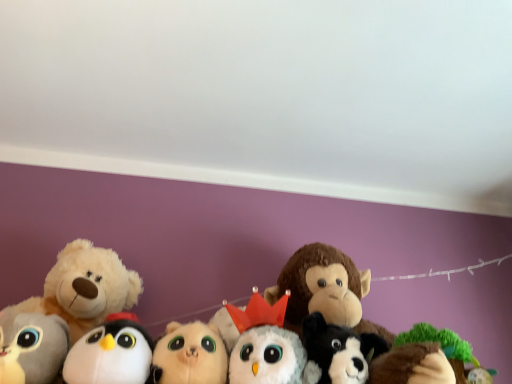
Where is `white plush penguin at lower left, the 5th toy positioned from the right`? This screenshot has height=384, width=512. white plush penguin at lower left, the 5th toy positioned from the right is located at coordinates [111, 353].

You are a GUI agent. You are given a task and a screenshot of the screen. Output one action in this format:
    pyautogui.click(x=<x>, y=<y>)
    Task: Click on the gray plush toy at lower left, the seventh toy in the right-to-left sequence
    
    Given the screenshot: What is the action you would take?
    pyautogui.click(x=31, y=346)

What do you see at coordinates (31, 346) in the screenshot?
I see `gray plush toy at lower left, the seventh toy in the right-to-left sequence` at bounding box center [31, 346].

Where is `white plush owl at center, the 5th toy when ordered from left to right`? The image size is (512, 384). white plush owl at center, the 5th toy when ordered from left to right is located at coordinates (267, 346).

I want to click on white plush dog at center, the 6th toy from the left, so click(340, 350).

Image resolution: width=512 pixels, height=384 pixels. Find the location of `white plush penguin at lower left, the 5th toy positioned from the right`. white plush penguin at lower left, the 5th toy positioned from the right is located at coordinates (111, 353).

Is point (104, 341) closer or farther from the camera than point (46, 315)?

Clearly, point (104, 341) is closer to the camera than point (46, 315).

Is white plush penguin at lower left, placed as the 3th toy when sorted from left to right, wider than gray plush toy at lower left, the first toy when ordered from left to right?

No, white plush penguin at lower left, placed as the 3th toy when sorted from left to right, is not wider than gray plush toy at lower left, the first toy when ordered from left to right.

From the image's perspective, between white plush penguin at lower left, placed as the 3th toy when sorted from left to right, and gray plush toy at lower left, the seventh toy in the right-to-left sequence, which one is located above?

white plush penguin at lower left, placed as the 3th toy when sorted from left to right.

Is white plush penguin at lower left, placed as the 3th toy when sorted from left to right, looking in the opposite direction of gray plush toy at lower left, the seventh toy in the right-to-left sequence?

No, white plush penguin at lower left, placed as the 3th toy when sorted from left to right, is not facing away from gray plush toy at lower left, the seventh toy in the right-to-left sequence.

Is green plush tree at lower right, arranged as the seventh toy when viewed from the left, far away from white plush owl at center, which is the third toy in right-to-left order?

No, green plush tree at lower right, arranged as the seventh toy when viewed from the left, is not far away from white plush owl at center, which is the third toy in right-to-left order.

Considering the sizes of green plush tree at lower right, arranged as the seventh toy when viewed from the left, and white plush owl at center, which is the third toy in right-to-left order, in the image, is green plush tree at lower right, arranged as the seventh toy when viewed from the left, bigger or smaller than white plush owl at center, which is the third toy in right-to-left order,?

In the image, green plush tree at lower right, arranged as the seventh toy when viewed from the left, appears to be smaller than white plush owl at center, which is the third toy in right-to-left order.

From the white plush owl at center, the 5th toy when ordered from left to right, count 2nd toy to the right and point to it. Please provide its 2D coordinates.

[(449, 351)]

From the picture: From a real-world perspective, which is physically above, green plush tree at lower right, acting as the 1th toy starting from the right, or white plush owl at center, which is the third toy in right-to-left order?

white plush owl at center, which is the third toy in right-to-left order, is physically above.

Would you say green plush tree at lower right, arranged as the seventh toy when viewed from the left, is inside or outside white plush penguin at lower left, the 5th toy positioned from the right?

green plush tree at lower right, arranged as the seventh toy when viewed from the left, is spatially situated outside white plush penguin at lower left, the 5th toy positioned from the right.

Is green plush tree at lower right, acting as the 1th toy starting from the right, touching white plush penguin at lower left, the 5th toy positioned from the right?

green plush tree at lower right, acting as the 1th toy starting from the right, and white plush penguin at lower left, the 5th toy positioned from the right, are not in contact.

Is point (408, 336) closer to viewer compared to point (124, 351)?

No, it is not.

Considering the positions of objects white plush dog at center, the 6th toy from the left, and white plush penguin at lower left, placed as the 3th toy when sorted from left to right, in the image provided, who is more to the left, white plush dog at center, the 6th toy from the left, or white plush penguin at lower left, placed as the 3th toy when sorted from left to right,?

From the viewer's perspective, white plush penguin at lower left, placed as the 3th toy when sorted from left to right, appears more on the left side.

This screenshot has width=512, height=384. Identify the location of toy that is the 4th one when counting downward from the white plush penguin at lower left, the 5th toy positioned from the right (from the image's perspective). (340, 350).

Is white plush dog at center, which is the second toy from right to left, oriented away from white plush penguin at lower left, the 5th toy positioned from the right?

No, white plush dog at center, which is the second toy from right to left, is not facing away from white plush penguin at lower left, the 5th toy positioned from the right.

Between white plush dog at center, which is the second toy from right to left, and white plush penguin at lower left, placed as the 3th toy when sorted from left to right, which one has more height?

white plush penguin at lower left, placed as the 3th toy when sorted from left to right, is taller.

Considering the relative sizes of white plush owl at center, the 5th toy when ordered from left to right, and fluffy beige cat at center, acting as the 4th toy starting from the right, in the image provided, is white plush owl at center, the 5th toy when ordered from left to right, bigger than fluffy beige cat at center, acting as the 4th toy starting from the right,?

Yes.

Can you see white plush owl at center, which is the third toy in right-to-left order, touching fluffy beige cat at center, which is counted as the 4th toy, starting from the left?

Yes, white plush owl at center, which is the third toy in right-to-left order, is beside fluffy beige cat at center, which is counted as the 4th toy, starting from the left.

Is the position of white plush owl at center, which is the third toy in right-to-left order, more distant than that of fluffy beige cat at center, which is counted as the 4th toy, starting from the left?

Yes, white plush owl at center, which is the third toy in right-to-left order, is further from the camera.

Would you say green plush tree at lower right, arranged as the seventh toy when viewed from the left, is a long distance from fluffy white teddy bear at left, arranged as the sixth toy when viewed from the right?

No, green plush tree at lower right, arranged as the seventh toy when viewed from the left, is in close proximity to fluffy white teddy bear at left, arranged as the sixth toy when viewed from the right.

Is green plush tree at lower right, acting as the 1th toy starting from the right, wider or thinner than fluffy white teddy bear at left, the second toy from the left?

Considering their sizes, green plush tree at lower right, acting as the 1th toy starting from the right, looks slimmer than fluffy white teddy bear at left, the second toy from the left.

Is green plush tree at lower right, acting as the 1th toy starting from the right, bigger than fluffy white teddy bear at left, arranged as the sixth toy when viewed from the right?

No.

Can you tell me how much green plush tree at lower right, arranged as the seventh toy when viewed from the left, and fluffy white teddy bear at left, the second toy from the left, differ in facing direction?

The facing directions of green plush tree at lower right, arranged as the seventh toy when viewed from the left, and fluffy white teddy bear at left, the second toy from the left, are 4.24 degrees apart.

How distant is white plush penguin at lower left, the 5th toy positioned from the right, from white plush owl at center, the 5th toy when ordered from left to right?

white plush penguin at lower left, the 5th toy positioned from the right, is 8.70 inches from white plush owl at center, the 5th toy when ordered from left to right.

I want to click on the 2nd toy located above the white plush penguin at lower left, the 5th toy positioned from the right (from a real-world perspective), so click(x=267, y=346).

Which of these two, white plush penguin at lower left, the 5th toy positioned from the right, or white plush owl at center, the 5th toy when ordered from left to right, is wider?

white plush owl at center, the 5th toy when ordered from left to right, is wider.

Looking at this image, could you tell me if white plush penguin at lower left, the 5th toy positioned from the right, is facing white plush owl at center, which is the third toy in right-to-left order?

No.

What are the coordinates of `toy in front of the white plush penguin at lower left, the 5th toy positioned from the right` in the screenshot? It's located at (31, 346).

Starting from the white plush owl at center, the 5th toy when ordered from left to right, which toy is the 2nd one to the right? Please provide its 2D coordinates.

[(449, 351)]

Considering their positions, is white plush owl at center, which is the third toy in right-to-left order, positioned further to white plush penguin at lower left, placed as the 3th toy when sorted from left to right, than fluffy white teddy bear at left, arranged as the sixth toy when viewed from the right?

white plush owl at center, which is the third toy in right-to-left order, is further to white plush penguin at lower left, placed as the 3th toy when sorted from left to right.

Estimate the real-world distances between objects in this image. Which object is further from white plush owl at center, which is the third toy in right-to-left order, fluffy beige cat at center, which is counted as the 4th toy, starting from the left, or green plush tree at lower right, arranged as the seventh toy when viewed from the left?

The object further to white plush owl at center, which is the third toy in right-to-left order, is green plush tree at lower right, arranged as the seventh toy when viewed from the left.

Which object lies nearer to the anchor point fluffy beige cat at center, acting as the 4th toy starting from the right, white plush owl at center, which is the third toy in right-to-left order, or white plush dog at center, the 6th toy from the left?

Based on the image, white plush owl at center, which is the third toy in right-to-left order, appears to be nearer to fluffy beige cat at center, acting as the 4th toy starting from the right.

Looking at the image, which one is located further to white plush penguin at lower left, the 5th toy positioned from the right, fluffy white teddy bear at left, arranged as the sixth toy when viewed from the right, or gray plush toy at lower left, the seventh toy in the right-to-left sequence?

Among the two, fluffy white teddy bear at left, arranged as the sixth toy when viewed from the right, is located further to white plush penguin at lower left, the 5th toy positioned from the right.

Consider the image. Estimate the real-world distances between objects in this image. Which object is further from fluffy white teddy bear at left, arranged as the sixth toy when viewed from the right, fluffy beige cat at center, which is counted as the 4th toy, starting from the left, or green plush tree at lower right, acting as the 1th toy starting from the right?

Based on the image, green plush tree at lower right, acting as the 1th toy starting from the right, appears to be further to fluffy white teddy bear at left, arranged as the sixth toy when viewed from the right.

Looking at the image, which one is located closer to fluffy white teddy bear at left, the second toy from the left, fluffy beige cat at center, acting as the 4th toy starting from the right, or white plush penguin at lower left, placed as the 3th toy when sorted from left to right?

white plush penguin at lower left, placed as the 3th toy when sorted from left to right, is positioned closer to the anchor fluffy white teddy bear at left, the second toy from the left.

From the image, which object appears to be farther from white plush owl at center, the 5th toy when ordered from left to right, fluffy white teddy bear at left, arranged as the sixth toy when viewed from the right, or white plush penguin at lower left, placed as the 3th toy when sorted from left to right?

Based on the image, fluffy white teddy bear at left, arranged as the sixth toy when viewed from the right, appears to be further to white plush owl at center, the 5th toy when ordered from left to right.

Consider the image. When comparing their distances from green plush tree at lower right, arranged as the seventh toy when viewed from the left, does fluffy beige cat at center, which is counted as the 4th toy, starting from the left, or gray plush toy at lower left, the first toy when ordered from left to right, seem closer?

fluffy beige cat at center, which is counted as the 4th toy, starting from the left.

Locate an element on the screen. toy between white plush penguin at lower left, the 5th toy positioned from the right, and white plush owl at center, the 5th toy when ordered from left to right is located at coordinates (190, 355).

The image size is (512, 384). In order to click on toy located between fluffy white teddy bear at left, the second toy from the left, and fluffy beige cat at center, acting as the 4th toy starting from the right, in the left-right direction in this screenshot , I will do `click(111, 353)`.

Locate an element on the screen. This screenshot has width=512, height=384. toy between gray plush toy at lower left, the seventh toy in the right-to-left sequence, and white plush penguin at lower left, the 5th toy positioned from the right is located at coordinates (84, 288).

The width and height of the screenshot is (512, 384). Identify the location of toy between white plush owl at center, the 5th toy when ordered from left to right, and green plush tree at lower right, arranged as the seventh toy when viewed from the left, from left to right. (340, 350).